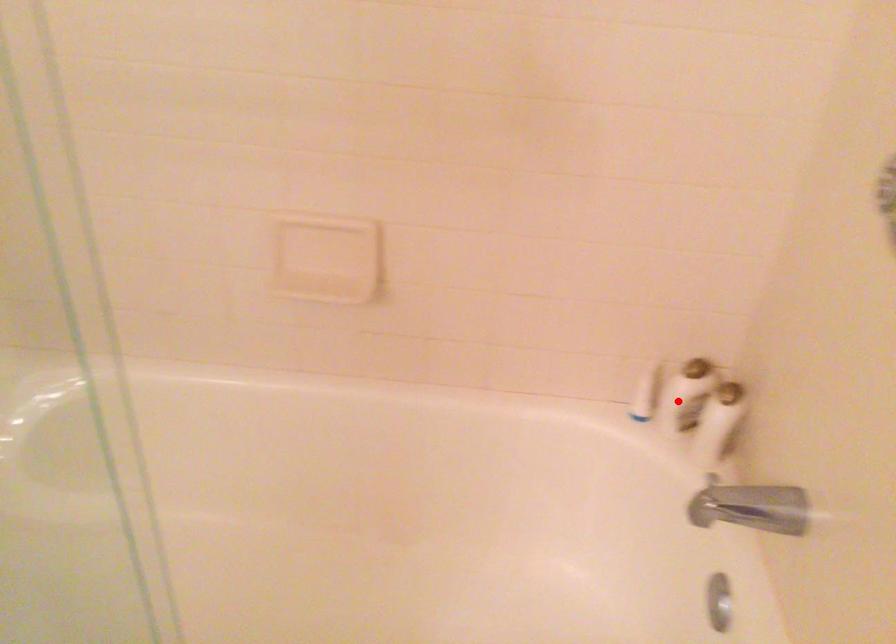
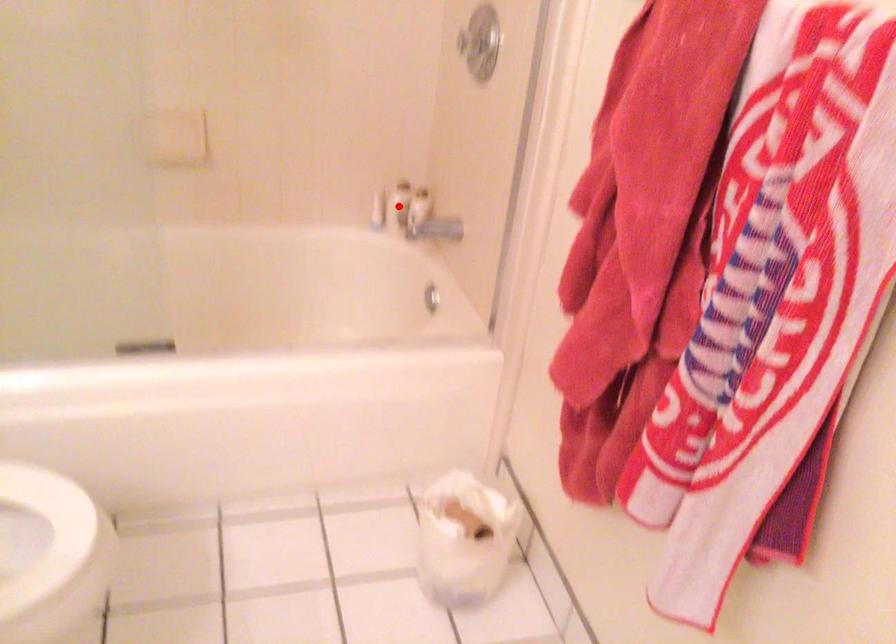
I am providing you with two images of the same scene from different viewpoints. A red point is marked on the first image and another point is marked on the second image. Do the highlighted points in image1 and image2 indicate the same real-world spot?

Yes